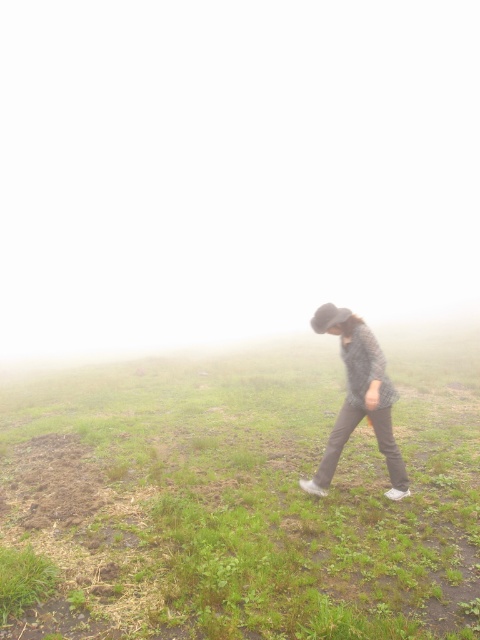
Question: Can you confirm if plaid fabric shirt at center is positioned to the right of green grassy at lower left?

Choices:
 (A) no
 (B) yes

Answer: (B)

Question: Does foggy mist at upper center appear on the right side of plaid fabric shirt at center?

Choices:
 (A) no
 (B) yes

Answer: (A)

Question: Which of the following is the farthest from the observer?

Choices:
 (A) (280, 556)
 (B) (32, 568)
 (C) (285, 112)

Answer: (C)

Question: Which point appears closest to the camera in this image?

Choices:
 (A) (332, 310)
 (B) (3, 326)
 (C) (424, 488)
 (D) (46, 573)

Answer: (D)

Question: In this image, where is green grassy at center located relative to plaid fabric shirt at center?

Choices:
 (A) right
 (B) left

Answer: (B)

Question: Which point is farther from the camera taking this photo?

Choices:
 (A) (346, 403)
 (B) (84, 296)
 (C) (0, 564)

Answer: (B)